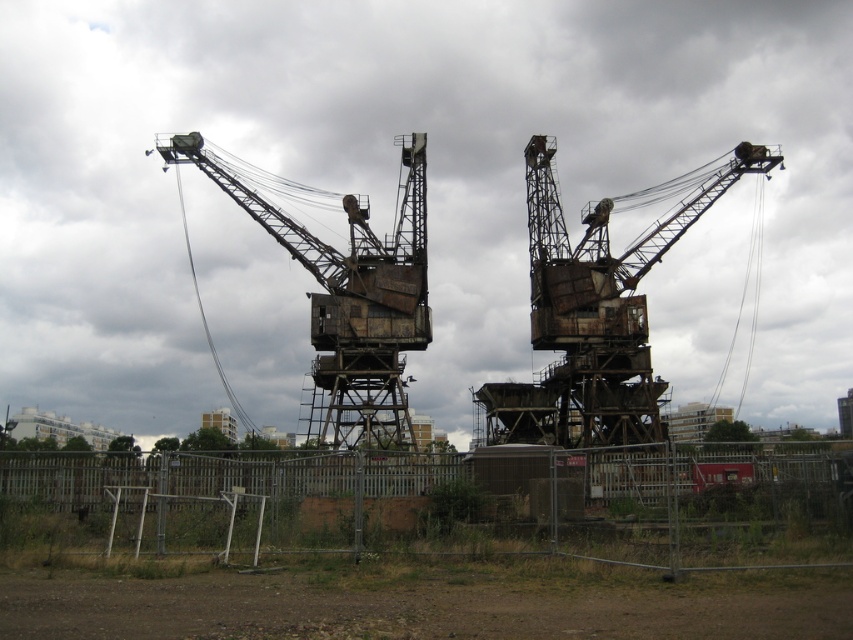
Is point (532, 508) farther from camera compared to point (392, 428)?

No, (532, 508) is in front of (392, 428).

Which of these two, metal fence at lower center or rusty metal crane at center, stands taller?

Standing taller between the two is rusty metal crane at center.

Is point (563, 470) farther from camera compared to point (421, 227)?

No, (563, 470) is in front of (421, 227).

Find the location of a particular element. metal fence at lower center is located at coordinates (451, 504).